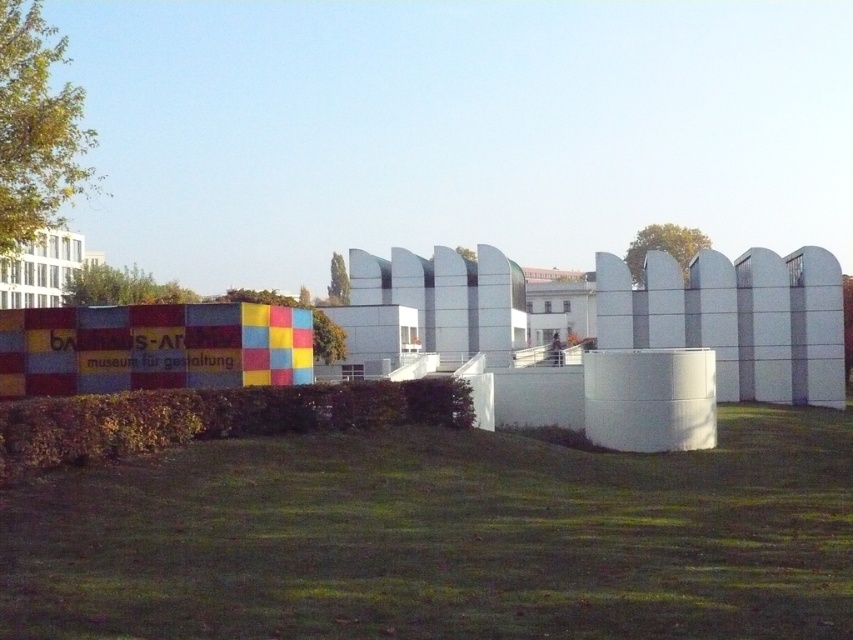
Question: Which object is farther from the camera taking this photo?

Choices:
 (A) green grass at lower center
 (B) white smooth fence at center

Answer: (B)

Question: Among these objects, which one is farthest from the camera?

Choices:
 (A) green grass at lower center
 (B) green leafy hedge at lower center

Answer: (B)

Question: Can you confirm if green grass at lower center is thinner than green leafy hedge at lower center?

Choices:
 (A) no
 (B) yes

Answer: (A)

Question: Among these objects, which one is nearest to the camera?

Choices:
 (A) green grass at lower center
 (B) white smooth fence at center
 (C) green leafy hedge at lower center

Answer: (A)

Question: Can you confirm if green grass at lower center is wider than white smooth fence at center?

Choices:
 (A) no
 (B) yes

Answer: (A)

Question: Can you confirm if green grass at lower center is positioned above green leafy hedge at lower center?

Choices:
 (A) no
 (B) yes

Answer: (A)